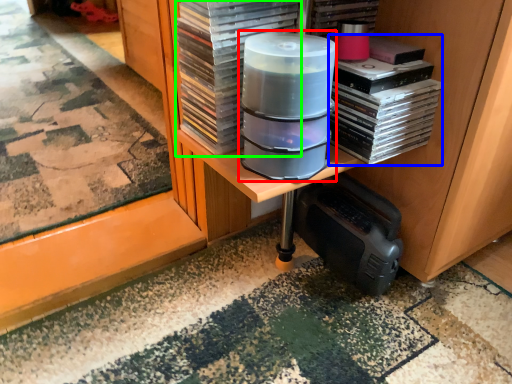
Question: Considering the real-world distances, which object is farthest from appliance (highlighted by a red box)? book (highlighted by a blue box) or paperback book (highlighted by a green box)?

Choices:
 (A) book
 (B) paperback book

Answer: (A)